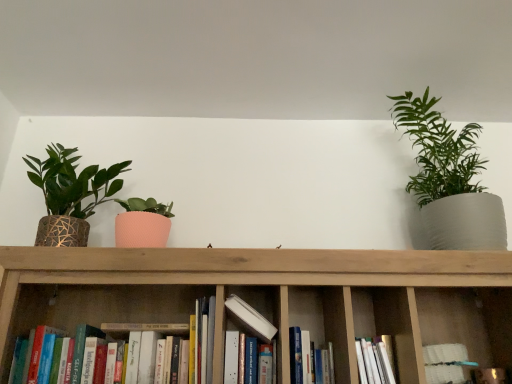
Image resolution: width=512 pixels, height=384 pixels. Describe the element at coordinates (273, 297) in the screenshot. I see `wooden bookshelf at center` at that location.

What are the coordinates of `green matte plant at upper right, the 1th houseplant positioned from the right` in the screenshot? It's located at (449, 179).

The image size is (512, 384). Identify the location of wooden bookshelf at center. coord(400,329).

At what (x,y) coordinates should I click in order to perform the action: click on white matte book at center, the 4th book in the left-to-right sequence. Please return your answer as a coordinate pair (x, y). Image resolution: width=512 pixels, height=384 pixels. Looking at the image, I should click on (446, 363).

How much space does white matte book at center, positioned as the third book in right-to-left order, occupy horizontally?

It is 5.27 inches.

Describe the element at coordinates (70, 194) in the screenshot. I see `textured woven pot at left, acting as the first houseplant starting from the left` at that location.

Find the location of a particular element. The height and width of the screenshot is (384, 512). wooden bookshelf at center is located at coordinates (273, 297).

Does textured woven pot at left, acting as the first houseplant starting from the left, have a greater height compared to white matte book at center, the first book in the right-to-left sequence?

Correct, textured woven pot at left, acting as the first houseplant starting from the left, is much taller as white matte book at center, the first book in the right-to-left sequence.

Which is more to the left, textured woven pot at left, acting as the first houseplant starting from the left, or white matte book at center, the first book in the right-to-left sequence?

textured woven pot at left, acting as the first houseplant starting from the left.

Based on the photo, from a real-world perspective, which object rests below the other?

From a 3D spatial view, white matte book at center, the first book in the right-to-left sequence, is below.

Considering the positions of objects textured woven pot at left, acting as the first houseplant starting from the left, and white matte book at center, the first book in the right-to-left sequence, in the image provided, who is in front, textured woven pot at left, acting as the first houseplant starting from the left, or white matte book at center, the first book in the right-to-left sequence,?

white matte book at center, the first book in the right-to-left sequence, is more forward.

Which is more to the left, wooden bookshelf at center or wooden bookshelf at center?

Positioned to the left is wooden bookshelf at center.

Which object is further away from the camera, wooden bookshelf at center or wooden bookshelf at center?

Positioned behind is wooden bookshelf at center.

This screenshot has height=384, width=512. I want to click on shelf in front of the wooden bookshelf at center, so click(273, 297).

Does white matte book at center, which is the 2th book in left-to-right order, turn towards wooden bookshelf at center?

No, white matte book at center, which is the 2th book in left-to-right order, does not turn towards wooden bookshelf at center.

From the image's perspective, between white matte book at center, which is the 2th book in left-to-right order, and wooden bookshelf at center, which one is located above?

white matte book at center, which is the 2th book in left-to-right order, is shown above in the image.

Is white matte book at center, which is the 2th book in left-to-right order, positioned before wooden bookshelf at center?

No, it is behind wooden bookshelf at center.

Can you confirm if white matte book at center, which is the 2th book in left-to-right order, is positioned to the right of wooden bookshelf at center?

In fact, white matte book at center, which is the 2th book in left-to-right order, is to the left of wooden bookshelf at center.

From a real-world perspective, relative to textured woven pot at left, acting as the 2th houseplant starting from the right, is white matte book at center, which is the 2th book in left-to-right order, vertically above or below?

Clearly, from a real-world perspective, white matte book at center, which is the 2th book in left-to-right order, is below textured woven pot at left, acting as the 2th houseplant starting from the right.

Is white matte book at center, which is the 2th book in left-to-right order, with textured woven pot at left, acting as the 2th houseplant starting from the right?

There is a gap between white matte book at center, which is the 2th book in left-to-right order, and textured woven pot at left, acting as the 2th houseplant starting from the right.

Looking at this image, can you confirm if white matte book at center, which is the 2th book in left-to-right order, is wider than textured woven pot at left, acting as the first houseplant starting from the left?

Incorrect, the width of white matte book at center, which is the 2th book in left-to-right order, does not surpass that of textured woven pot at left, acting as the first houseplant starting from the left.

This screenshot has height=384, width=512. Find the location of `book in front of the white matte book at center, which is the 2th book in left-to-right order`. book in front of the white matte book at center, which is the 2th book in left-to-right order is located at coordinates (125, 320).

Is white matte book at center, which is the 2th book in left-to-right order, positioned beyond the bounds of hardcover books at center, the fourth book from the right?

Absolutely, white matte book at center, which is the 2th book in left-to-right order, is external to hardcover books at center, the fourth book from the right.

Is white matte book at center, which is the 2th book in left-to-right order, oriented towards hardcover books at center, the fourth book from the right?

No, white matte book at center, which is the 2th book in left-to-right order, is not facing towards hardcover books at center, the fourth book from the right.

Is white matte book at center, positioned as the third book in right-to-left order, in front of hardcover books at center, the fourth book from the right?

No, the depth of white matte book at center, positioned as the third book in right-to-left order, is greater than that of hardcover books at center, the fourth book from the right.

Is textured woven pot at left, acting as the first houseplant starting from the left, bigger or smaller than green matte plant at upper right, the 1th houseplant positioned from the right?

Clearly, textured woven pot at left, acting as the first houseplant starting from the left, is smaller in size than green matte plant at upper right, the 1th houseplant positioned from the right.

Between textured woven pot at left, acting as the first houseplant starting from the left, and green matte plant at upper right, the 1th houseplant positioned from the right, which one has larger width?

green matte plant at upper right, the 1th houseplant positioned from the right, is wider.

Considering the sizes of objects textured woven pot at left, acting as the first houseplant starting from the left, and green matte plant at upper right, marked as the second houseplant in a left-to-right arrangement, in the image provided, who is shorter, textured woven pot at left, acting as the first houseplant starting from the left, or green matte plant at upper right, marked as the second houseplant in a left-to-right arrangement,?

Standing shorter between the two is textured woven pot at left, acting as the first houseplant starting from the left.

Find the location of `houseplant that is on the left side of green matte plant at upper right, the 1th houseplant positioned from the right`. houseplant that is on the left side of green matte plant at upper right, the 1th houseplant positioned from the right is located at coordinates (70, 194).

Is point (264, 335) closer or farther from the camera than point (329, 306)?

Point (264, 335) is closer to the camera than point (329, 306).

Can you confirm if white matte book at center, positioned as the third book in right-to-left order, is shorter than wooden bookshelf at center?

Yes, white matte book at center, positioned as the third book in right-to-left order, is shorter than wooden bookshelf at center.

From the picture: From a real-world perspective, is white matte book at center, positioned as the third book in right-to-left order, over wooden bookshelf at center?

No, from a real-world perspective, white matte book at center, positioned as the third book in right-to-left order, is not above wooden bookshelf at center.

At what (x,y) coordinates should I click in order to perform the action: click on the 4th book below the textured woven pot at left, acting as the first houseplant starting from the left (from the image's perspective). Please return your answer as a coordinate pair (x, y). The height and width of the screenshot is (384, 512). Looking at the image, I should click on (446, 363).

Locate an element on the screen. This screenshot has width=512, height=384. cabinet lying behind the wooden bookshelf at center is located at coordinates (400, 329).

Which object lies further to the anchor point textured woven pot at left, acting as the first houseplant starting from the left, green matte plant at upper right, the 1th houseplant positioned from the right, or white matte book at center, positioned as the third book in right-to-left order?

Among the two, green matte plant at upper right, the 1th houseplant positioned from the right, is located further to textured woven pot at left, acting as the first houseplant starting from the left.

Looking at the image, which one is located closer to hardcover books at center, which is counted as the 1th book, starting from the left, textured woven pot at left, acting as the first houseplant starting from the left, or white matte book at center, the 4th book in the left-to-right sequence?

textured woven pot at left, acting as the first houseplant starting from the left, lies closer to hardcover books at center, which is counted as the 1th book, starting from the left, than the other object.

When comparing their distances from green matte plant at upper right, the 1th houseplant positioned from the right, does white matte book at center, positioned as the third book in right-to-left order, or wooden bookshelf at center seem further?

white matte book at center, positioned as the third book in right-to-left order.

Looking at this image, which object lies nearer to the anchor point green matte plant at upper right, marked as the second houseplant in a left-to-right arrangement, textured woven pot at left, acting as the first houseplant starting from the left, or hardcover books at center, the fourth book from the right?

hardcover books at center, the fourth book from the right, is closer to green matte plant at upper right, marked as the second houseplant in a left-to-right arrangement.

Estimate the real-world distances between objects in this image. Which object is further from white matte book at center, which is the 2th book in left-to-right order, wooden bookshelf at center or hardcover book at center, which ranks as the third book in left-to-right order?

The object further to white matte book at center, which is the 2th book in left-to-right order, is wooden bookshelf at center.

Which object lies nearer to the anchor point white matte book at center, which is the 2th book in left-to-right order, wooden bookshelf at center or hardcover books at center, which is counted as the 1th book, starting from the left?

Among the two, hardcover books at center, which is counted as the 1th book, starting from the left, is located nearer to white matte book at center, which is the 2th book in left-to-right order.

From the picture: From the image, which object appears to be farther from wooden bookshelf at center, hardcover books at center, the fourth book from the right, or white matte book at center, the 4th book in the left-to-right sequence?

white matte book at center, the 4th book in the left-to-right sequence, is positioned further to the anchor wooden bookshelf at center.

Which object lies further to the anchor point white matte book at center, the 4th book in the left-to-right sequence, green matte plant at upper right, the 1th houseplant positioned from the right, or hardcover books at center, which is counted as the 1th book, starting from the left?

hardcover books at center, which is counted as the 1th book, starting from the left, lies further to white matte book at center, the 4th book in the left-to-right sequence, than the other object.

Where is `shelf between textured woven pot at left, acting as the 2th houseplant starting from the right, and green matte plant at upper right, marked as the second houseplant in a left-to-right arrangement, from left to right`? The image size is (512, 384). shelf between textured woven pot at left, acting as the 2th houseplant starting from the right, and green matte plant at upper right, marked as the second houseplant in a left-to-right arrangement, from left to right is located at coordinates (273, 297).

Locate an element on the screen. cabinet between green matte plant at upper right, marked as the second houseplant in a left-to-right arrangement, and white matte book at center, the first book in the right-to-left sequence, from top to bottom is located at coordinates (400, 329).

Where is `cabinet between hardcover book at center, which ranks as the third book in left-to-right order, and white matte book at center, the 4th book in the left-to-right sequence, from left to right`? The height and width of the screenshot is (384, 512). cabinet between hardcover book at center, which ranks as the third book in left-to-right order, and white matte book at center, the 4th book in the left-to-right sequence, from left to right is located at coordinates (400, 329).

You are a GUI agent. You are given a task and a screenshot of the screen. Output one action in this format:
    pyautogui.click(x=<x>, y=<y>)
    Task: Click on the book located between white matte book at center, positioned as the third book in right-to-left order, and white matte book at center, the 4th book in the left-to-right sequence, in the left-right direction
    The image size is (512, 384).
    Given the screenshot: What is the action you would take?
    pyautogui.click(x=309, y=360)